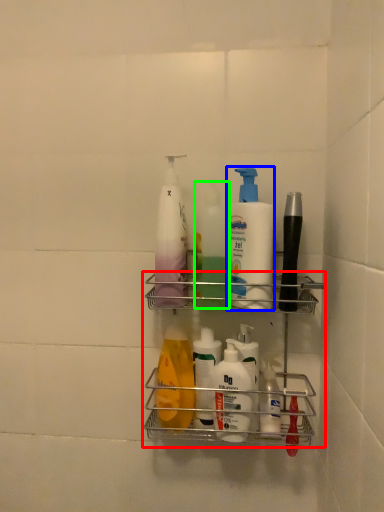
Question: Which is farther away from shelf (highlighted by a red box)? cleaning product (highlighted by a blue box) or cleaning product (highlighted by a green box)?

Choices:
 (A) cleaning product
 (B) cleaning product

Answer: (B)